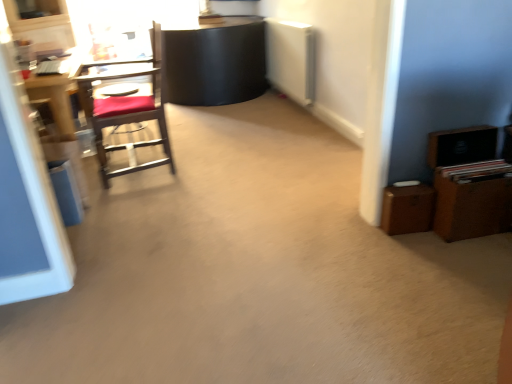
Identify the location of vacant region to the right of wooden chair with red cushion at left. This screenshot has width=512, height=384. (218, 172).